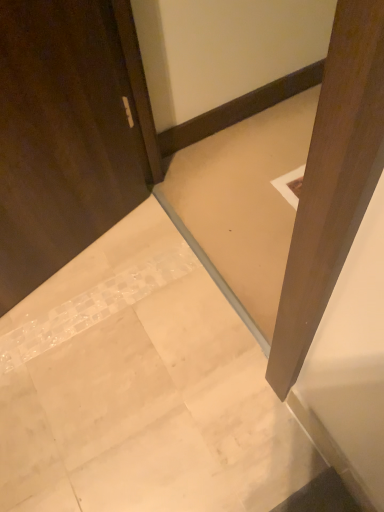
The height and width of the screenshot is (512, 384). What do you see at coordinates (145, 391) in the screenshot?
I see `white marble tile at lower left` at bounding box center [145, 391].

The height and width of the screenshot is (512, 384). I want to click on white marble tile at lower left, so click(x=145, y=391).

At what (x,y) coordinates should I click in order to perform the action: click on white marble tile at lower left. Please return your answer as a coordinate pair (x, y). Looking at the image, I should click on (145, 391).